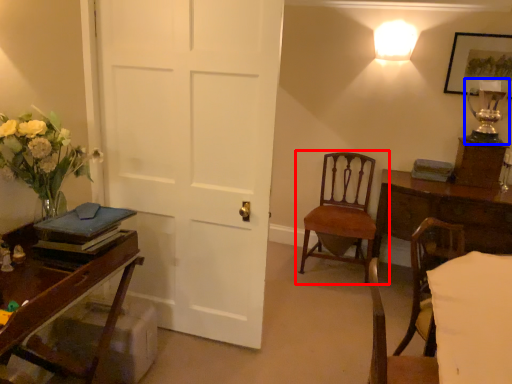
Question: Which object appears closest to the camera in this image, chair (highlighted by a red box) or table lamp (highlighted by a blue box)?

Choices:
 (A) chair
 (B) table lamp

Answer: (B)